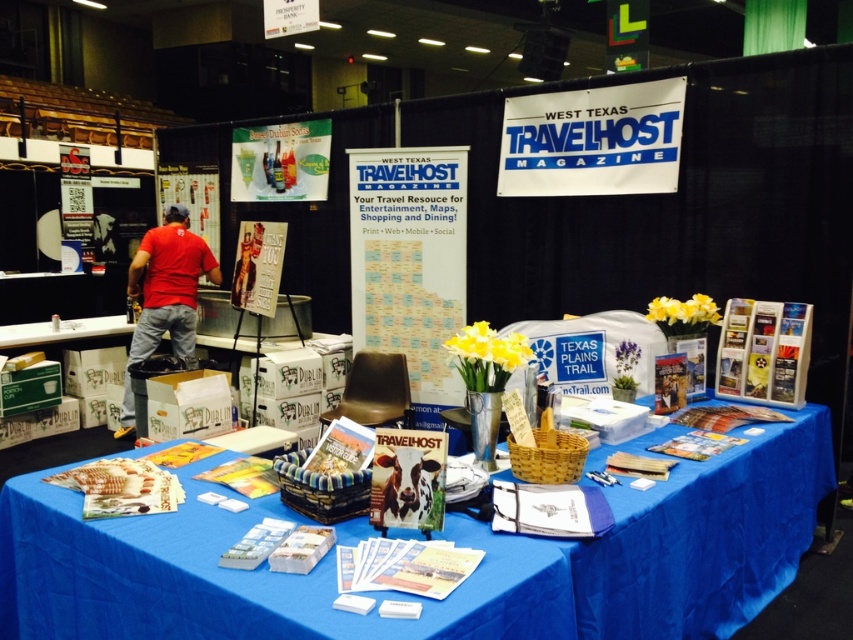
Does blue fabric table at center have a lesser height compared to red cotton t-shirt at left?

Yes, blue fabric table at center is shorter than red cotton t-shirt at left.

Can you confirm if blue fabric table at center is positioned to the left of red cotton t-shirt at left?

In fact, blue fabric table at center is to the right of red cotton t-shirt at left.

Is point (219, 600) more distant than point (186, 296)?

That is False.

I want to click on blue fabric table at center, so 444,538.